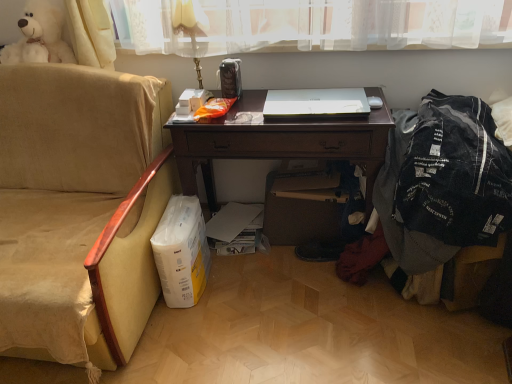
In order to click on vacant space in front of dark wood desk at center in this screenshot , I will do [291, 320].